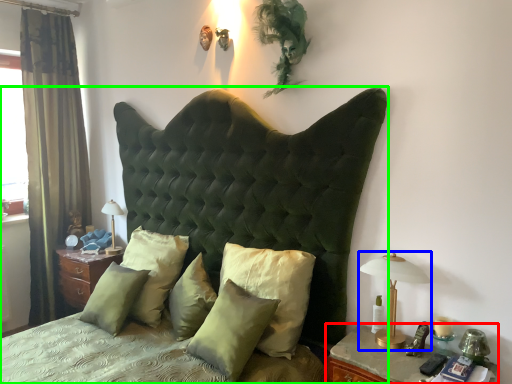
Question: Which object is positioned farthest from nightstand (highlighted by a red box)? Select from bedside lamp (highlighted by a blue box) and bed (highlighted by a green box).

Choices:
 (A) bedside lamp
 (B) bed

Answer: (B)